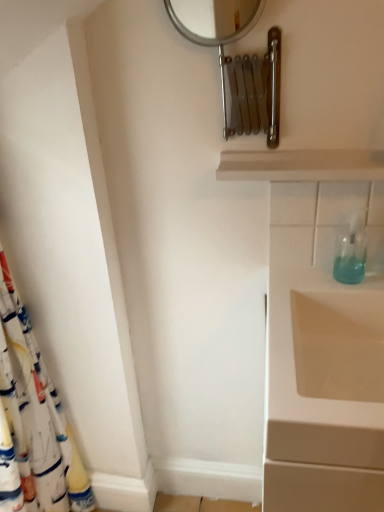
The image size is (384, 512). I want to click on vacant region to the left of transparent plastic soap dispenser at right, so click(305, 284).